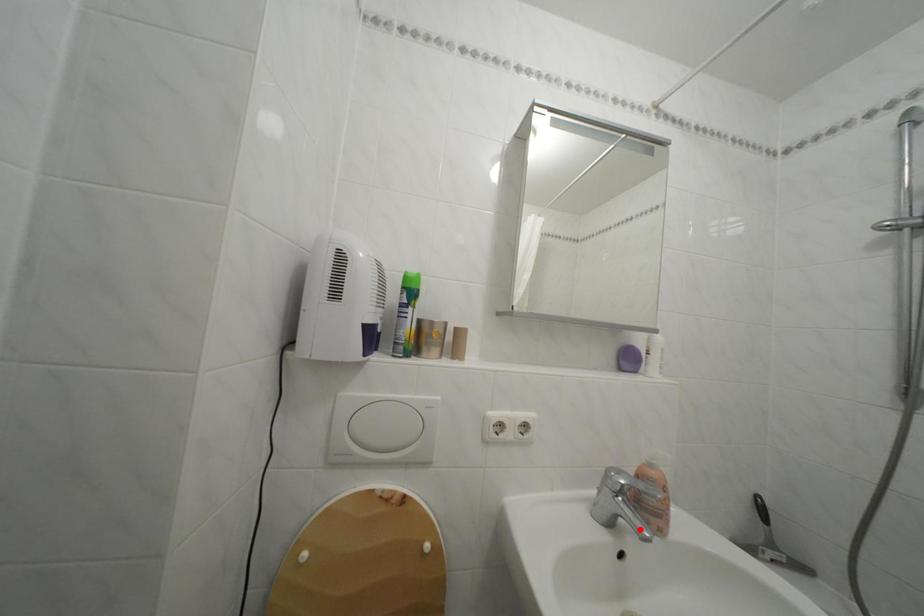
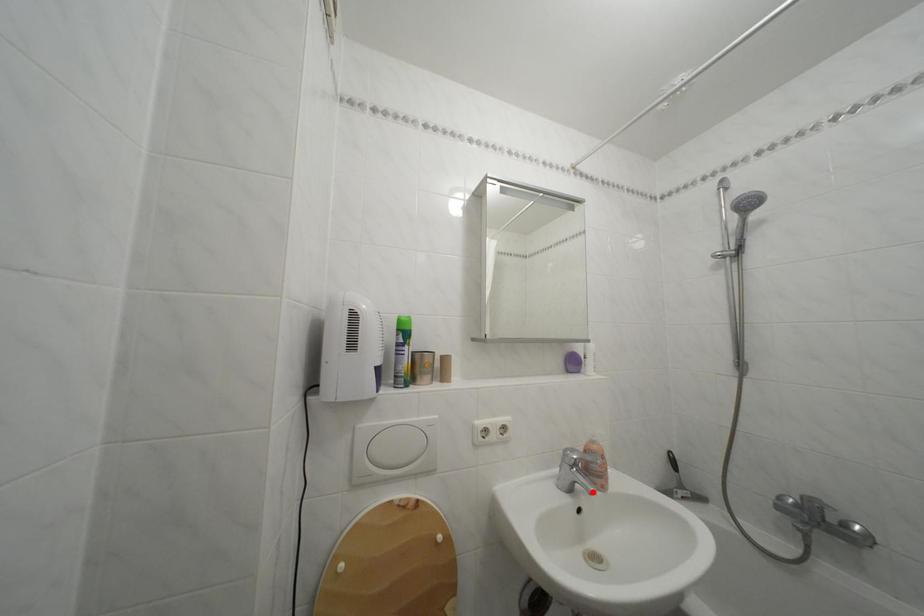
I am providing you with two images of the same scene from different viewpoints. A red point is marked on the first image and another point is marked on the second image. Is the marked point in image1 the same physical position as the marked point in image2?

Yes